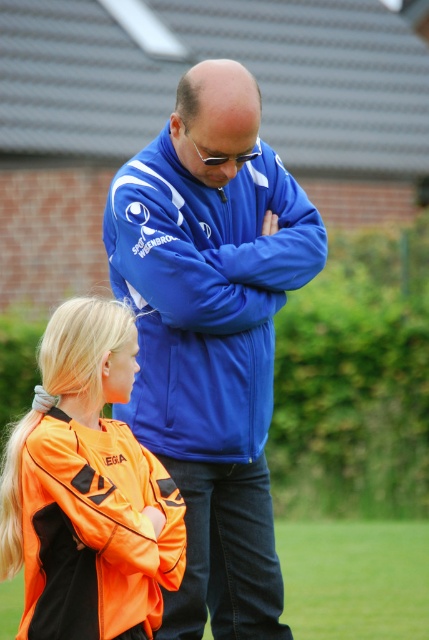
Question: Which point appears closest to the camera in this image?

Choices:
 (A) (156, 186)
 (B) (15, 618)

Answer: (A)

Question: In this image, where is orange fabric jacket at lower left located relative to green grass at lower center?

Choices:
 (A) above
 (B) below

Answer: (A)

Question: Estimate the real-world distances between objects in this image. Which object is farther from the orange fabric jacket at lower left?

Choices:
 (A) blue softshell jacket at center
 (B) green grass at lower center

Answer: (B)

Question: Can you confirm if blue softshell jacket at center is bigger than orange fabric jacket at lower left?

Choices:
 (A) yes
 (B) no

Answer: (A)

Question: Does blue softshell jacket at center appear on the right side of orange fabric jacket at lower left?

Choices:
 (A) no
 (B) yes

Answer: (B)

Question: Which point is closer to the camera?

Choices:
 (A) (157, 588)
 (B) (374, 577)
 (C) (117, 227)

Answer: (A)